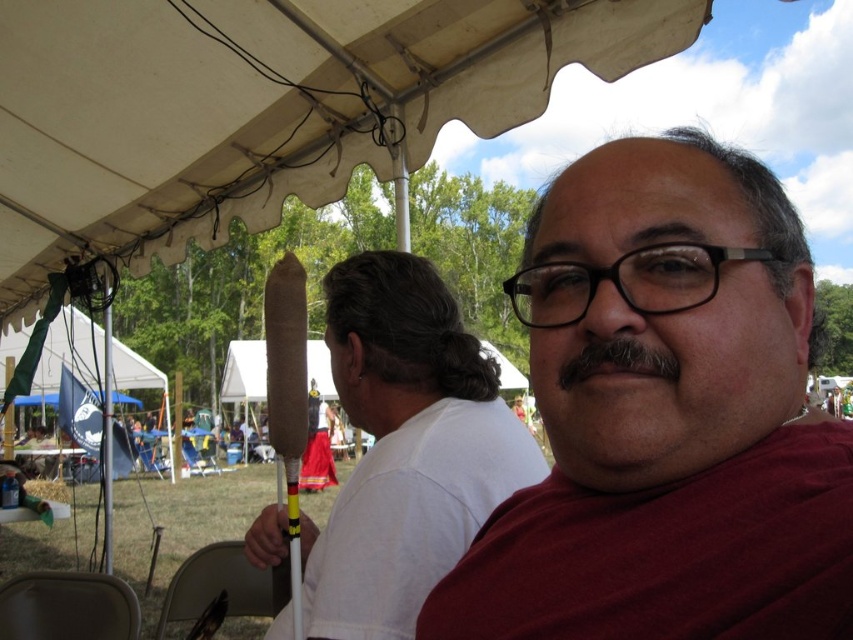
You are a food vendor at the fair and need to reach the brown paper cone at center to hand it to the customer in the maroon fabric shirt at center. Can you comfortably extend your arm to hand it to them without moving closer?

The distance between the maroon fabric shirt at center and the brown paper cone at center is 20.93 inches, so yes, you can comfortably extend your arm to hand it to them without moving closer.

You are at a fair and want to take a photo of the brown paper cone at center. To avoid blocking the background, should you position yourself under the white fabric canopy at upper center or below it?

The white fabric canopy at upper center is located above the brown paper cone at center. To avoid blocking the background, position yourself below the white fabric canopy at upper center so it doesn not obstruct the view of the brown paper cone at center.